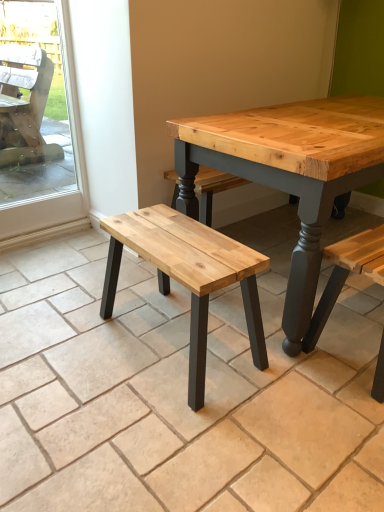
Question: Is transparent glass screen door at left touching natural wood bench at center?

Choices:
 (A) yes
 (B) no

Answer: (B)

Question: Is transparent glass screen door at left thinner than natural wood bench at center?

Choices:
 (A) no
 (B) yes

Answer: (B)

Question: Is transparent glass screen door at left aimed at natural wood bench at center?

Choices:
 (A) no
 (B) yes

Answer: (A)

Question: Is transparent glass screen door at left wider than natural wood bench at center?

Choices:
 (A) yes
 (B) no

Answer: (B)

Question: Does transparent glass screen door at left appear on the right side of natural wood bench at center?

Choices:
 (A) no
 (B) yes

Answer: (A)

Question: From the image's perspective, does transparent glass screen door at left appear lower than natural wood bench at center?

Choices:
 (A) yes
 (B) no

Answer: (B)

Question: Does natural wood bench at center appear on the right side of natural wood bench at center?

Choices:
 (A) no
 (B) yes

Answer: (A)

Question: Would you say natural wood bench at center is part of natural wood bench at center's contents?

Choices:
 (A) yes
 (B) no

Answer: (B)

Question: From a real-world perspective, is natural wood bench at center over natural wood bench at center?

Choices:
 (A) no
 (B) yes

Answer: (B)

Question: Is natural wood bench at center in front of natural wood bench at center?

Choices:
 (A) no
 (B) yes

Answer: (A)

Question: From the image's perspective, is natural wood bench at center under natural wood bench at center?

Choices:
 (A) yes
 (B) no

Answer: (A)

Question: From a real-world perspective, is natural wood bench at center positioned under natural wood bench at center based on gravity?

Choices:
 (A) yes
 (B) no

Answer: (B)

Question: From the image's perspective, is natural wood bench at center below natural wood bench at center?

Choices:
 (A) yes
 (B) no

Answer: (B)